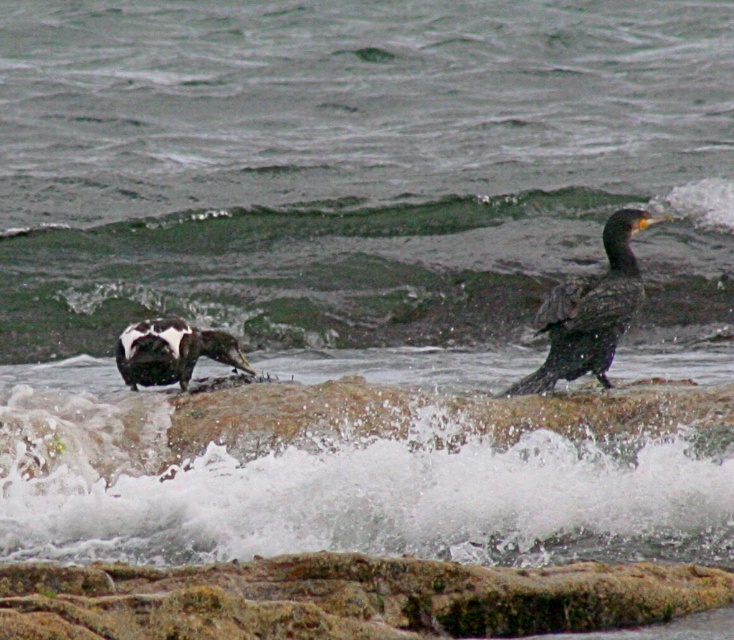
Is point (302, 259) farther from camera compared to point (523, 620)?

That is True.

Does green mossy rock at center have a lesser height compared to rusty rock at center?

Incorrect, green mossy rock at center's height does not fall short of rusty rock at center's.

Identify the location of green mossy rock at center. (305, 273).

Between white frothy water at center and dark feathers bird at right, which one is positioned higher?

dark feathers bird at right is above.

Can you confirm if white frothy water at center is bigger than dark feathers bird at right?

Indeed, white frothy water at center has a larger size compared to dark feathers bird at right.

What do you see at coordinates (335, 492) in the screenshot?
I see `white frothy water at center` at bounding box center [335, 492].

The width and height of the screenshot is (734, 640). In order to click on white frothy water at center in this screenshot , I will do pos(335,492).

Which of these two, white frothy water at center or green mossy rock at center, stands taller?

green mossy rock at center

Between white frothy water at center and green mossy rock at center, which one appears on the left side from the viewer's perspective?

white frothy water at center

Between point (437, 536) and point (241, 221), which one is positioned behind?

The point (241, 221) is more distant.

This screenshot has width=734, height=640. Identify the location of white frothy water at center. (335, 492).